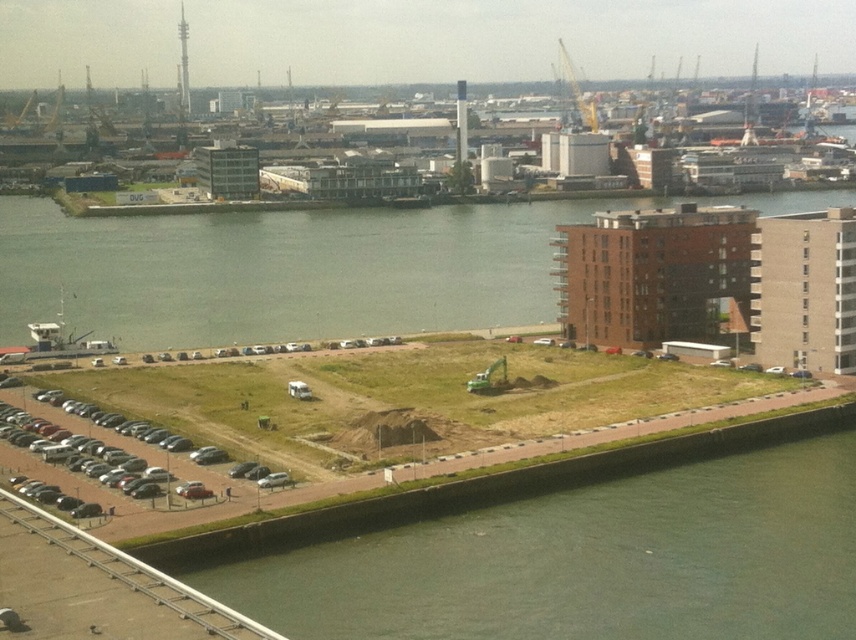
You are a landscape architect assessing the urban waterfront area. You notice two patches of green grass at lower left and green grass at lower center. Which area would you recommend for placing a new bench to ensure better visibility of the waterfront view?

The green grass at lower center should be chosen because it has thicker grass, providing a more stable and visually appealing base for the bench while maintaining clear views of the waterfront.

You are a landscape architect designing a new park. You need to determine if the green grass at lower left has enough space to accommodate a new flower bed compared to the metallic gray cars at lower left. Can you confirm if the green grass area is wider than the parking space for the cars?

The green grass at lower left might be wider than metallic gray cars at lower left, so there is a possibility that the green grass area could accommodate the flower bed if it is indeed wider. However, further measurements would be needed to confirm the exact dimensions.